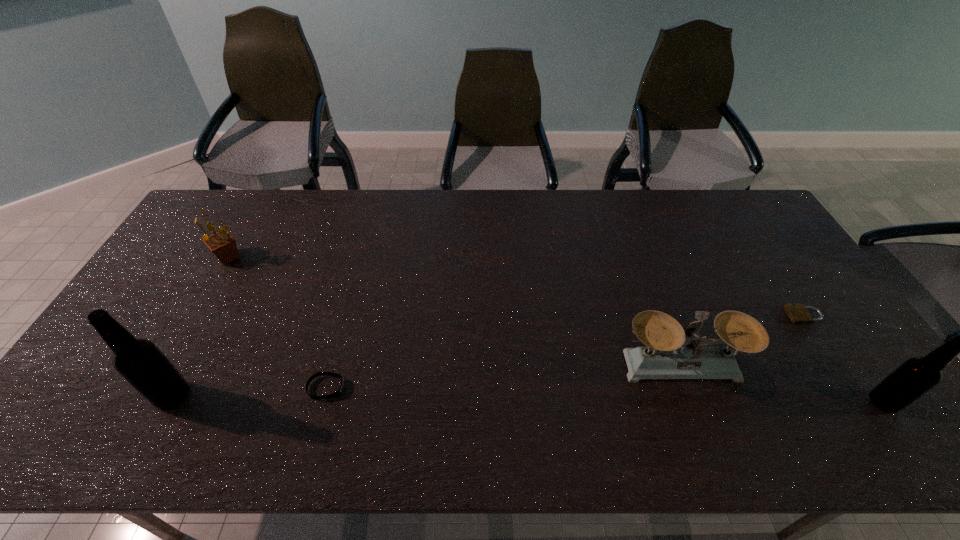
The width and height of the screenshot is (960, 540). Find the location of `padlock that is at the right edge`. padlock that is at the right edge is located at coordinates (797, 312).

I want to click on object located in the near right corner section of the desktop, so click(916, 376).

In the image, there is a desktop. Identify the location of vacant space at the far edge. (301, 198).

Identify the location of free space at the near edge of the desktop. The width and height of the screenshot is (960, 540). (739, 399).

Locate an element on the screen. The image size is (960, 540). vacant area at the right edge of the desktop is located at coordinates 759,247.

I want to click on vacant space at the far left corner of the desktop, so click(x=226, y=193).

Image resolution: width=960 pixels, height=540 pixels. In the image, there is a desktop. What are the coordinates of `blank space at the far right corner` in the screenshot? It's located at (721, 208).

The height and width of the screenshot is (540, 960). In order to click on vacant space in between the wristband and the padlock in this screenshot , I will do [565, 352].

I want to click on free spot between the left beer bottle and the fourth object from left to right, so click(x=427, y=381).

This screenshot has height=540, width=960. What are the coordinates of `vacant space in between the scale and the fourth object from right to left` in the screenshot? It's located at (504, 376).